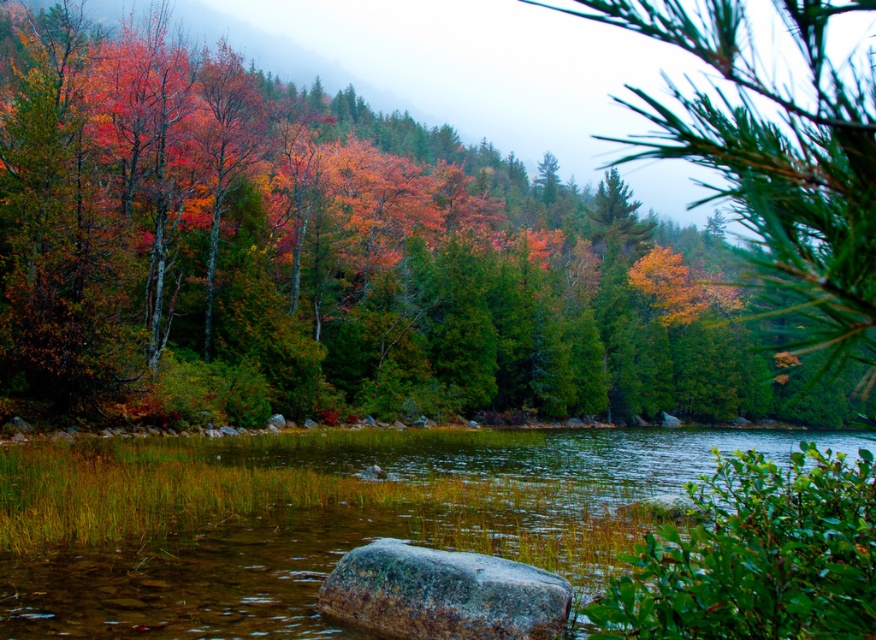
Where is `autumn leaves at center`? autumn leaves at center is located at coordinates (325, 256).

In the scene shown: Can you confirm if autumn leaves at center is positioned above clear water at center?

Indeed, autumn leaves at center is positioned over clear water at center.

Where is `autumn leaves at center`? This screenshot has height=640, width=876. autumn leaves at center is located at coordinates (325, 256).

Is clear water at center closer to the viewer compared to gray textured rock at center?

That is False.

Image resolution: width=876 pixels, height=640 pixels. Describe the element at coordinates (320, 516) in the screenshot. I see `clear water at center` at that location.

Image resolution: width=876 pixels, height=640 pixels. In order to click on clear water at center in this screenshot , I will do `click(320, 516)`.

Can you confirm if clear water at center is smaller than green matte pine branch at upper right?

Correct, clear water at center occupies less space than green matte pine branch at upper right.

Does clear water at center appear under green matte pine branch at upper right?

Yes, clear water at center is below green matte pine branch at upper right.

At what (x,y) coordinates should I click in order to perform the action: click on clear water at center. Please return your answer as a coordinate pair (x, y). Looking at the image, I should click on (320, 516).